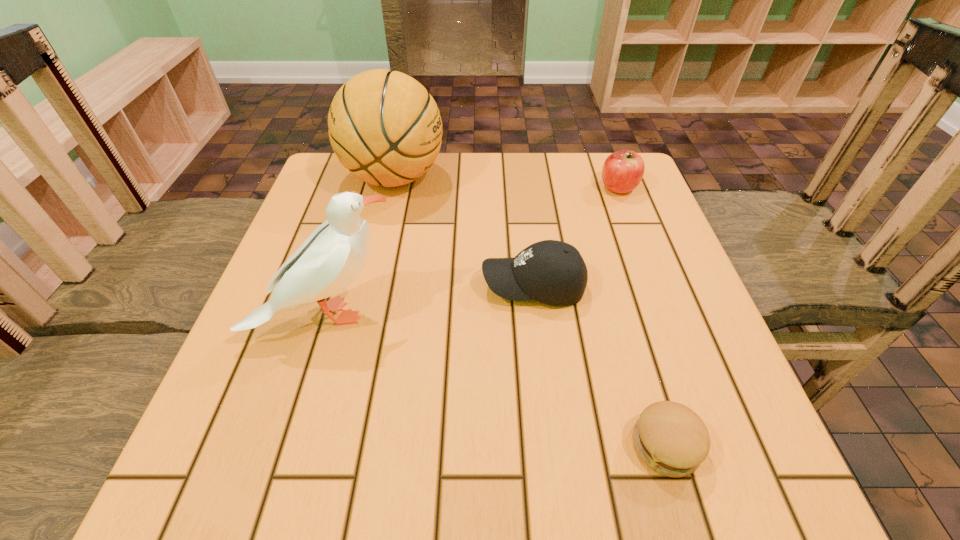
The width and height of the screenshot is (960, 540). What are the coordinates of `free space located 0.300m on the front-facing side of the baseball cap` in the screenshot? It's located at (329, 286).

Where is `free spot located 0.140m on the front-facing side of the baseball cap`? The width and height of the screenshot is (960, 540). free spot located 0.140m on the front-facing side of the baseball cap is located at coordinates (411, 286).

Identify the location of vacant area situated 0.120m on the left of the hamburger. (550, 446).

The image size is (960, 540). In order to click on basketball at the far edge in this screenshot , I will do `click(384, 126)`.

Where is `apple present at the far edge`? The width and height of the screenshot is (960, 540). apple present at the far edge is located at coordinates (623, 170).

This screenshot has width=960, height=540. What are the coordinates of `object present at the near edge` in the screenshot? It's located at (670, 438).

Where is `basketball located at the left edge`? The width and height of the screenshot is (960, 540). basketball located at the left edge is located at coordinates 384,126.

Image resolution: width=960 pixels, height=540 pixels. I want to click on gull at the left edge, so click(329, 260).

The image size is (960, 540). Find the location of `apple that is at the right edge`. apple that is at the right edge is located at coordinates (623, 170).

At what (x,y) coordinates should I click in order to perform the action: click on hamburger that is positioned at the right edge. Please return your answer as a coordinate pair (x, y). The height and width of the screenshot is (540, 960). Looking at the image, I should click on (670, 438).